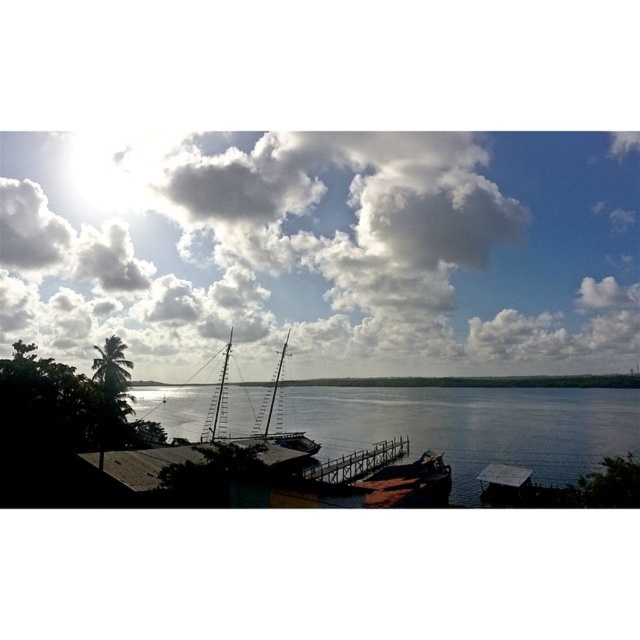
At what (x,y) coordinates should I click in order to perform the action: click on rusty metal dock at lower left. Please return your answer as a coordinate pair (x, y). The width and height of the screenshot is (640, 640). Looking at the image, I should click on (179, 460).

Who is more forward, [198,464] or [280,349]?

Point [198,464] is in front.

Where is `rusty metal dock at lower left`? The width and height of the screenshot is (640, 640). rusty metal dock at lower left is located at coordinates (179, 460).

Does rusty metal dock at lower left appear under wooden dock at center?

Incorrect, rusty metal dock at lower left is not positioned below wooden dock at center.

In the scene shown: Who is shorter, rusty metal dock at lower left or wooden dock at center?

rusty metal dock at lower left is shorter.

Locate an element on the screen. The image size is (640, 640). rusty metal dock at lower left is located at coordinates (179, 460).

I want to click on rusty metal dock at lower left, so click(x=179, y=460).

Does white fluffy cloud at upper center have a larger size compared to wooden dock at center?

Indeed, white fluffy cloud at upper center has a larger size compared to wooden dock at center.

Can you confirm if white fluffy cloud at upper center is positioned above wooden dock at center?

Yes.

At what (x,y) coordinates should I click in order to perform the action: click on white fluffy cloud at upper center. Please return your answer as a coordinate pair (x, y). Looking at the image, I should click on (330, 248).